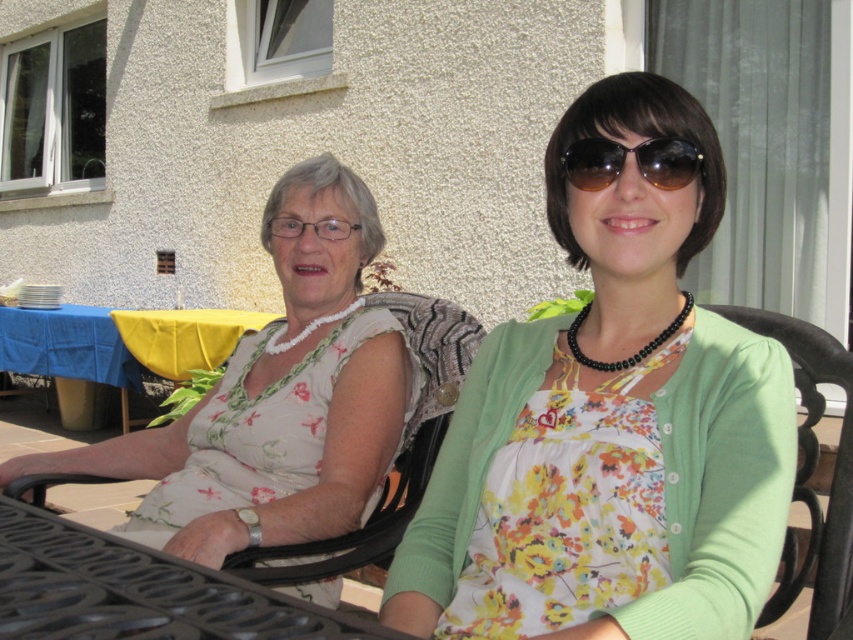
Question: Which object is closer to the camera taking this photo?

Choices:
 (A) brown reflective sunglasses at center
 (B) blue cloth-covered table at lower left
 (C) black metal table at lower left
 (D) yellow fabric table at lower left

Answer: (C)

Question: Is the position of floral fabric dress at left more distant than that of black metal table at lower left?

Choices:
 (A) yes
 (B) no

Answer: (A)

Question: Does black plastic chair at center have a greater width compared to yellow fabric table at lower left?

Choices:
 (A) no
 (B) yes

Answer: (A)

Question: Based on their relative distances, which object is farther from the black metal table at lower left?

Choices:
 (A) green fabric chair at right
 (B) brown reflective sunglasses at center
 (C) blue cloth-covered table at lower left
 (D) black plastic chair at center

Answer: (C)

Question: Does black plastic chair at center appear on the left side of brown reflective sunglasses at center?

Choices:
 (A) yes
 (B) no

Answer: (A)

Question: Which object is the closest to the brown reflective sunglasses at center?

Choices:
 (A) floral fabric dress at left
 (B) black metal table at lower left
 (C) floral fabric dress at center
 (D) blue cloth-covered table at lower left

Answer: (C)